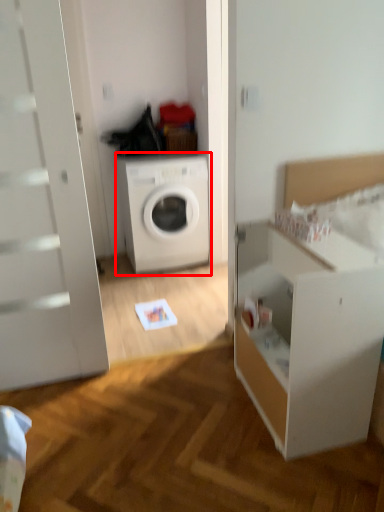
Question: From the image, what is the correct spatial relationship of washing machine (annotated by the red box) in relation to dresser?

Choices:
 (A) right
 (B) left

Answer: (B)